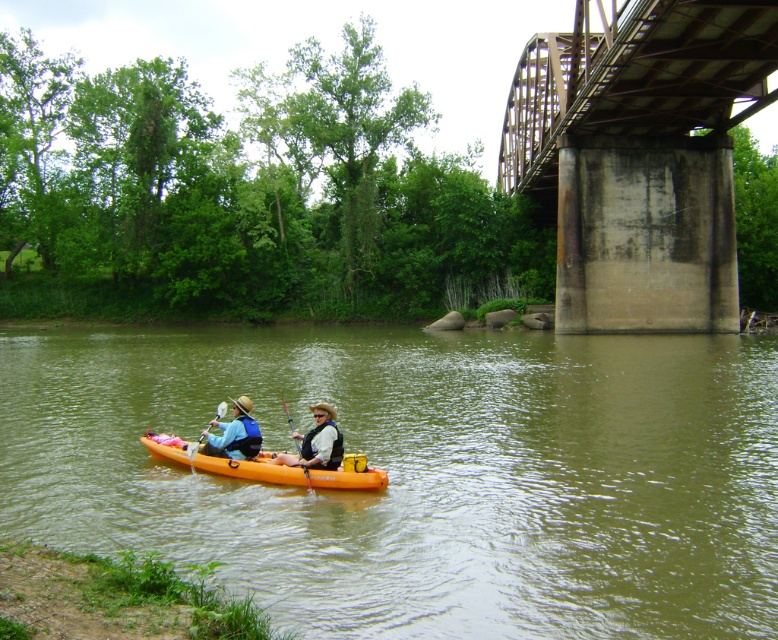
Question: Is orange plastic kayak at center positioned behind matte blue life vest at center?

Choices:
 (A) no
 (B) yes

Answer: (A)

Question: Which object is the farthest from the wooden textured paddle at center?

Choices:
 (A) orange plastic kayak at center
 (B) orange matte kayak at center
 (C) wooden paddle at center
 (D) white matte life vest at center

Answer: (A)

Question: Is white matte life vest at center above matte blue life vest at center?

Choices:
 (A) yes
 (B) no

Answer: (B)

Question: Which object is the closest to the matte blue life vest at center?

Choices:
 (A) rusty metal bridge at upper right
 (B) orange plastic kayak at center

Answer: (B)

Question: Does white matte life vest at center have a larger size compared to wooden paddle at center?

Choices:
 (A) no
 (B) yes

Answer: (A)

Question: Which of the following is the farthest from the observer?

Choices:
 (A) (244, 396)
 (B) (701, 368)
 (C) (205, 461)

Answer: (B)